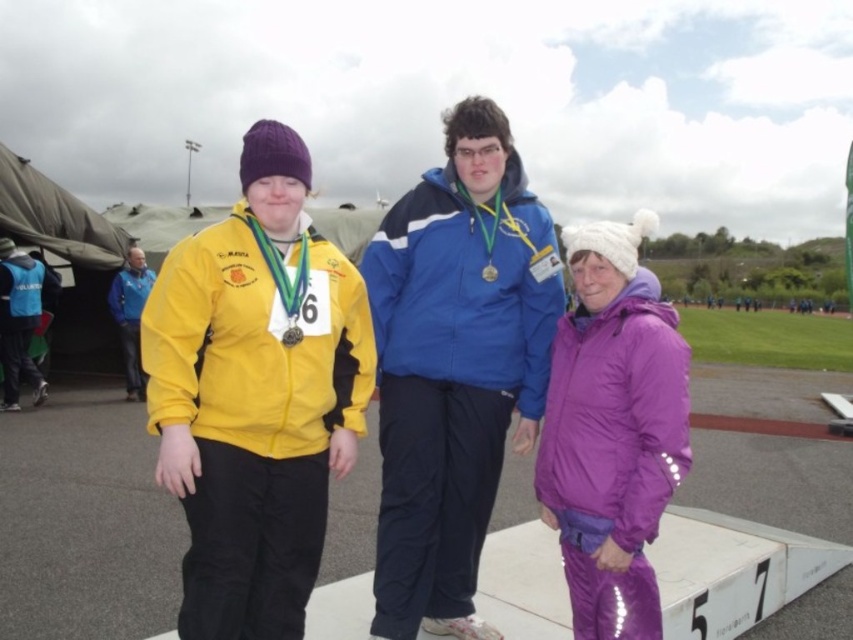
Is blue fabric jacket at left positioned behind gold metallic medal at center?

Yes, it is behind gold metallic medal at center.

Which is more to the left, blue fabric jacket at left or gold metallic medal at center?

blue fabric jacket at left is more to the left.

Measure the distance between blue fabric jacket at left and camera.

11.22 meters

At what (x,y) coordinates should I click in order to perform the action: click on blue fabric jacket at left. Please return your answer as a coordinate pair (x, y). Looking at the image, I should click on (131, 316).

Is matte yellow jacket at center behind blue fleece jacket at center?

No, matte yellow jacket at center is in front of blue fleece jacket at center.

Is matte yellow jacket at center thinner than blue fleece jacket at center?

Yes.

Does point (310, 307) lie behind point (431, 621)?

No, it is not.

Where is `matte yellow jacket at center`? matte yellow jacket at center is located at coordinates (254, 394).

Does point (138, 376) lie behind point (296, 314)?

That is True.

How much distance is there between blue fabric jacket at left and metallic gold medal at center?

blue fabric jacket at left is 31.91 feet away from metallic gold medal at center.

What do you see at coordinates (131, 316) in the screenshot? I see `blue fabric jacket at left` at bounding box center [131, 316].

Find the location of `blue fabric jacket at left`. blue fabric jacket at left is located at coordinates (131, 316).